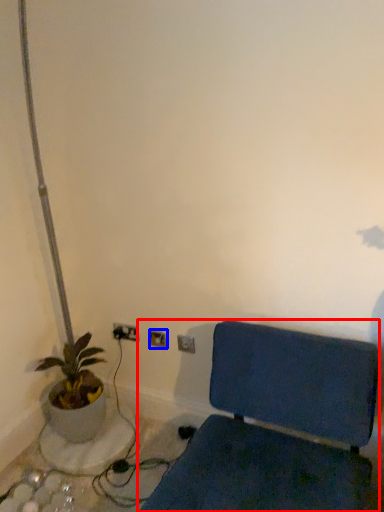
Question: Which of the following is the farthest to the observer, furniture (highlighted by a red box) or electric outlet (highlighted by a blue box)?

Choices:
 (A) furniture
 (B) electric outlet

Answer: (B)